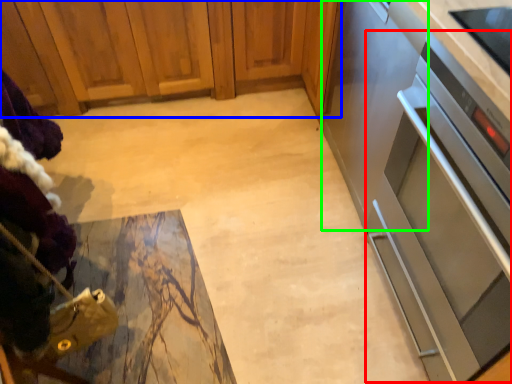
Question: Estimate the real-world distances between objects in this image. Which object is closer to oven (highlighted by a red box), cabinetry (highlighted by a blue box) or appliance (highlighted by a green box)?

Choices:
 (A) cabinetry
 (B) appliance

Answer: (B)